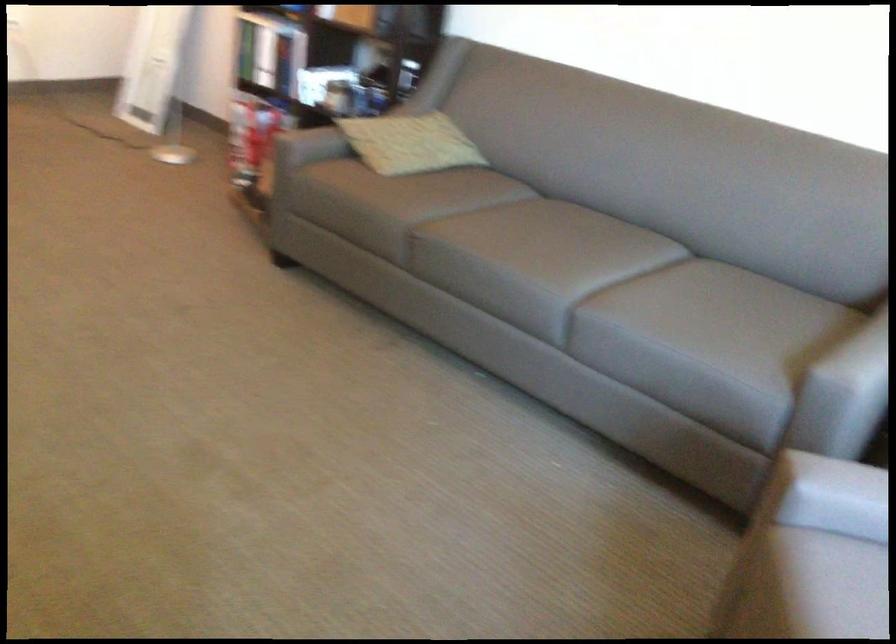
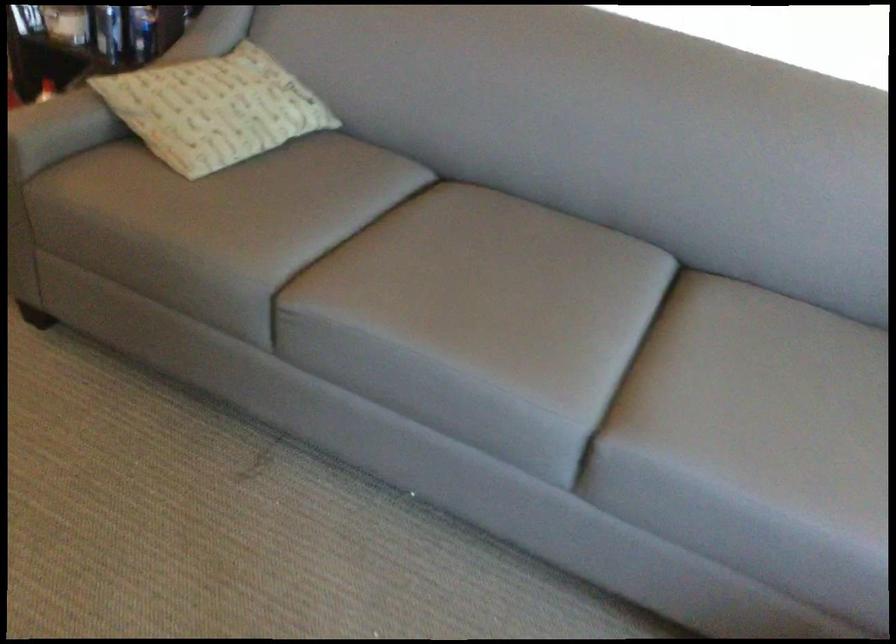
Find the pixel in the second image that matches [515,234] in the first image.

(479, 290)